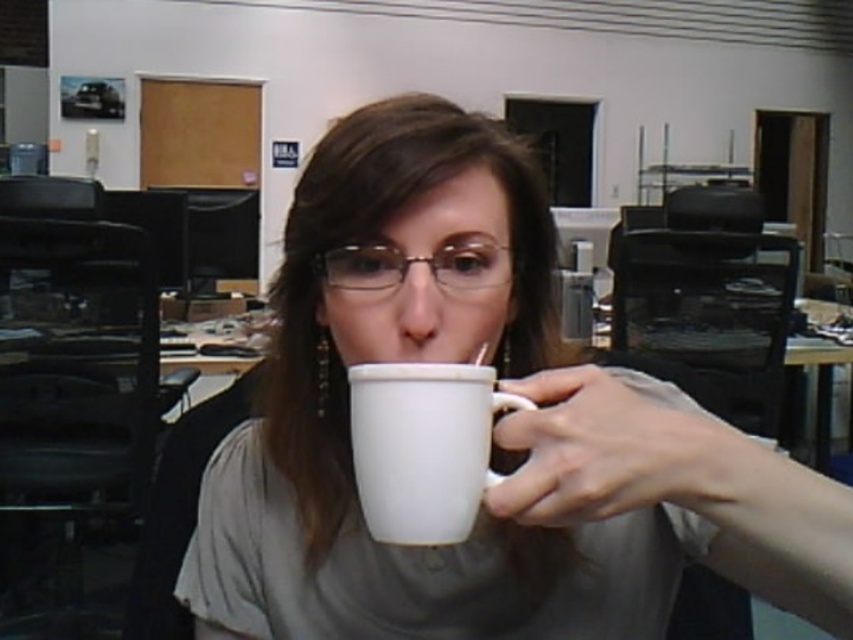
Question: Can you confirm if white glossy mug at center is smaller than white ceramic mug at center?

Choices:
 (A) no
 (B) yes

Answer: (A)

Question: In this image, where is white glossy mug at center located relative to white ceramic mug at center?

Choices:
 (A) left
 (B) right

Answer: (B)

Question: Which object is farther from the camera taking this photo?

Choices:
 (A) white ceramic mug at center
 (B) white glossy mug at center

Answer: (A)

Question: Which point is farther to the camera?

Choices:
 (A) white ceramic mug at center
 (B) white glossy mug at center

Answer: (A)

Question: Is white glossy mug at center closer to the viewer compared to white ceramic mug at center?

Choices:
 (A) yes
 (B) no

Answer: (A)

Question: Which object appears farthest from the camera in this image?

Choices:
 (A) white glossy mug at center
 (B) white ceramic mug at center

Answer: (B)